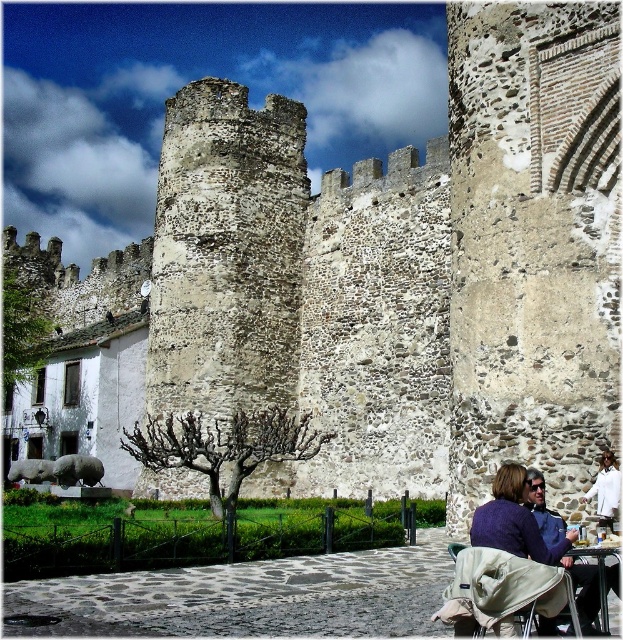
Is point (548, 586) in front of point (602, 621)?

Yes, it is in front of point (602, 621).

What are the coordinates of `beige fabric stroller at lower right` in the screenshot? It's located at (500, 588).

Is purple woolen sweater at lower right taller than metallic silver table at lower right?

No, purple woolen sweater at lower right is not taller than metallic silver table at lower right.

Who is more forward, (535, 554) or (606, 579)?

Positioned in front is point (535, 554).

The height and width of the screenshot is (640, 623). In order to click on purple woolen sweater at lower right in this screenshot , I will do `click(513, 520)`.

Can you confirm if beige fabric stroller at lower right is wider than purple woolen sweater at lower right?

Yes, beige fabric stroller at lower right is wider than purple woolen sweater at lower right.

Which is behind, point (487, 604) or point (502, 484)?

Positioned behind is point (502, 484).

Does point (492, 582) come behind point (500, 532)?

No, (492, 582) is closer to viewer.

This screenshot has width=623, height=640. In order to click on beige fabric stroller at lower right in this screenshot , I will do 500,588.